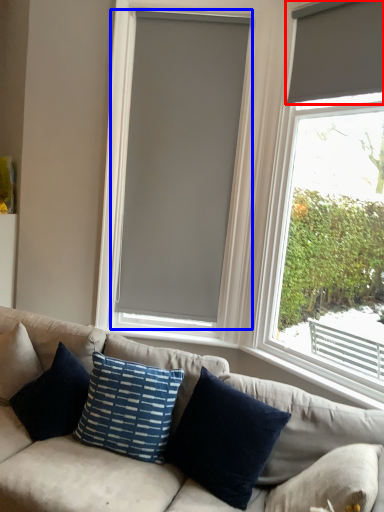
Question: Which point is further to the camera, window blind (highlighted by a red box) or window blind (highlighted by a blue box)?

Choices:
 (A) window blind
 (B) window blind

Answer: (B)